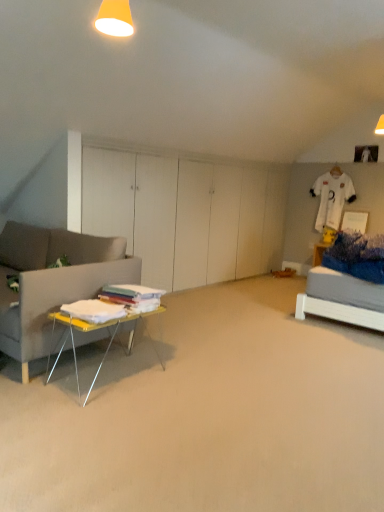
Locate an element on the screen. The image size is (384, 512). yellow matte lampshade at upper center is located at coordinates (115, 18).

Is yellow matte lampshade at upper center not close to white fabric at left?

yellow matte lampshade at upper center is far away from white fabric at left.

Can you confirm if yellow matte lampshade at upper center is wider than white fabric at left?

No, yellow matte lampshade at upper center is not wider than white fabric at left.

Looking at this image, between yellow matte lampshade at upper center and white fabric at left, which one has smaller size?

Smaller between the two is yellow matte lampshade at upper center.

From the image's perspective, which is above, yellow matte lampshade at upper center or white fabric at left?

yellow matte lampshade at upper center, from the image's perspective.

Consider the image. In the image, is yellow metallic table at lower left on the left side or the right side of white fabric at left?

yellow metallic table at lower left is positioned on white fabric at left's left side.

Are yellow metallic table at lower left and white fabric at left far apart?

No, yellow metallic table at lower left is not far away from white fabric at left.

Does yellow metallic table at lower left contain white fabric at left?

That's incorrect, white fabric at left is not inside yellow metallic table at lower left.

Is yellow metallic table at lower left bigger than white fabric at left?

Actually, yellow metallic table at lower left might be smaller than white fabric at left.

Could you tell me if white fabric at left is facing yellow matte lampshade at upper center?

No, white fabric at left does not turn towards yellow matte lampshade at upper center.

Is white fabric at left completely or partially outside of yellow matte lampshade at upper center?

Yes, white fabric at left is not within yellow matte lampshade at upper center.

Looking at this image, is white fabric at left wider than yellow matte lampshade at upper center?

Correct, the width of white fabric at left exceeds that of yellow matte lampshade at upper center.

Is there a large distance between white fabric at left and yellow matte lampshade at upper center?

Yes, white fabric at left and yellow matte lampshade at upper center are quite far apart.

From the image's perspective, does yellow matte lampshade at upper center appear higher than yellow metallic table at lower left?

Yes.

From their relative heights in the image, would you say yellow matte lampshade at upper center is taller or shorter than yellow metallic table at lower left?

In the image, yellow matte lampshade at upper center appears to be shorter than yellow metallic table at lower left.

Considering the relative sizes of yellow matte lampshade at upper center and yellow metallic table at lower left in the image provided, is yellow matte lampshade at upper center thinner than yellow metallic table at lower left?

Correct, the width of yellow matte lampshade at upper center is less than that of yellow metallic table at lower left.

Which object is positioned more to the right, yellow matte lampshade at upper center or yellow metallic table at lower left?

yellow matte lampshade at upper center is more to the right.

Is yellow metallic table at lower left positioned far away from yellow matte lampshade at upper center?

Absolutely, yellow metallic table at lower left is distant from yellow matte lampshade at upper center.

Considering the sizes of objects yellow metallic table at lower left and yellow matte lampshade at upper center in the image provided, who is smaller, yellow metallic table at lower left or yellow matte lampshade at upper center?

yellow matte lampshade at upper center is smaller.

You are a GUI agent. You are given a task and a screenshot of the screen. Output one action in this format:
    pyautogui.click(x=<x>, y=<y>)
    Task: Click on the lighting that is in front of the yellow metallic table at lower left
    This screenshot has height=512, width=384.
    Given the screenshot: What is the action you would take?
    pyautogui.click(x=115, y=18)

Find the location of a particular element. plain that appears in front of the yellow metallic table at lower left is located at coordinates (207, 415).

From the image's perspective, is white fabric at left above or below yellow metallic table at lower left?

From the image's perspective, white fabric at left appears below yellow metallic table at lower left.

Between white fabric at left and yellow metallic table at lower left, which one has smaller size?

With smaller size is yellow metallic table at lower left.

Is white fabric at left inside the boundaries of yellow metallic table at lower left, or outside?

white fabric at left is spatially situated outside yellow metallic table at lower left.

What are the coordinates of `lighting lying behind the white fabric at left` in the screenshot? It's located at (115, 18).

There is a white fabric at left. Where is `table above it (from a real-world perspective)`? This screenshot has width=384, height=512. table above it (from a real-world perspective) is located at coordinates (99, 328).

When comparing their distances from white fabric at left, does yellow matte lampshade at upper center or yellow metallic table at lower left seem further?

yellow matte lampshade at upper center is positioned further to the anchor white fabric at left.

Based on their spatial positions, is white fabric at left or yellow metallic table at lower left closer to yellow matte lampshade at upper center?

yellow metallic table at lower left.

Looking at the image, which one is located closer to yellow matte lampshade at upper center, yellow metallic table at lower left or white fabric at left?

yellow metallic table at lower left.

Consider the image. Looking at the image, which one is located further to white fabric at left, yellow metallic table at lower left or yellow matte lampshade at upper center?

yellow matte lampshade at upper center lies further to white fabric at left than the other object.

When comparing their distances from yellow metallic table at lower left, does yellow matte lampshade at upper center or white fabric at left seem further?

yellow matte lampshade at upper center.

Based on their spatial positions, is white fabric at left or yellow matte lampshade at upper center further from yellow metallic table at lower left?

yellow matte lampshade at upper center lies further to yellow metallic table at lower left than the other object.

I want to click on table that lies between yellow matte lampshade at upper center and white fabric at left from top to bottom, so click(x=99, y=328).